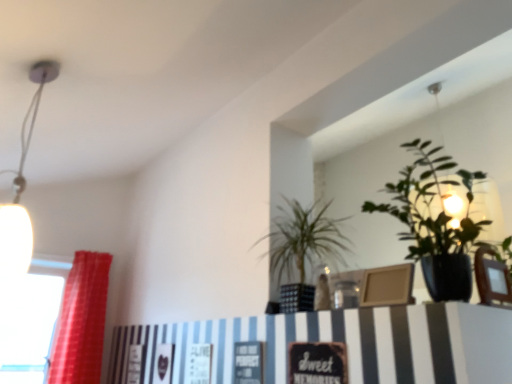
Question: Is green leafy plant at center, the first houseplant from the left, not inside red fabric curtain at left?

Choices:
 (A) yes
 (B) no

Answer: (A)

Question: From the image's perspective, is green leafy plant at center, the first houseplant from the left, located above red fabric curtain at left?

Choices:
 (A) yes
 (B) no

Answer: (A)

Question: From a real-world perspective, is green leafy plant at center, the second houseplant from the right, physically below red fabric curtain at left?

Choices:
 (A) no
 (B) yes

Answer: (A)

Question: Is green leafy plant at center, the second houseplant from the right, at the right side of red fabric curtain at left?

Choices:
 (A) no
 (B) yes

Answer: (B)

Question: From a real-world perspective, is green leafy plant at center, the second houseplant from the right, on red fabric curtain at left?

Choices:
 (A) no
 (B) yes

Answer: (B)

Question: Considering the relative positions of green leafy plant at center, the second houseplant from the right, and green glossy plant at upper right, arranged as the 2th houseplant when viewed from the left, in the image provided, is green leafy plant at center, the second houseplant from the right, to the left or to the right of green glossy plant at upper right, arranged as the 2th houseplant when viewed from the left,?

Choices:
 (A) left
 (B) right

Answer: (A)

Question: Is green leafy plant at center, the first houseplant from the left, taller or shorter than green glossy plant at upper right, which ranks as the first houseplant in right-to-left order?

Choices:
 (A) short
 (B) tall

Answer: (B)

Question: From a real-world perspective, is green leafy plant at center, the second houseplant from the right, positioned above or below green glossy plant at upper right, arranged as the 2th houseplant when viewed from the left?

Choices:
 (A) above
 (B) below

Answer: (B)

Question: Is green leafy plant at center, the first houseplant from the left, in front of or behind green glossy plant at upper right, arranged as the 2th houseplant when viewed from the left, in the image?

Choices:
 (A) behind
 (B) front

Answer: (A)

Question: From the image's perspective, is transparent glass window at left positioned above or below green leafy plant at center, the first houseplant from the left?

Choices:
 (A) below
 (B) above

Answer: (A)

Question: In terms of height, does transparent glass window at left look taller or shorter compared to green leafy plant at center, the second houseplant from the right?

Choices:
 (A) tall
 (B) short

Answer: (A)

Question: Looking at the image, does transparent glass window at left seem bigger or smaller compared to green leafy plant at center, the second houseplant from the right?

Choices:
 (A) small
 (B) big

Answer: (B)

Question: Considering their positions, is transparent glass window at left located in front of or behind green leafy plant at center, the first houseplant from the left?

Choices:
 (A) behind
 (B) front

Answer: (A)

Question: Based on their sizes in the image, would you say red fabric curtain at left is bigger or smaller than transparent glass window at left?

Choices:
 (A) big
 (B) small

Answer: (A)

Question: Considering their positions, is red fabric curtain at left located in front of or behind transparent glass window at left?

Choices:
 (A) behind
 (B) front

Answer: (B)